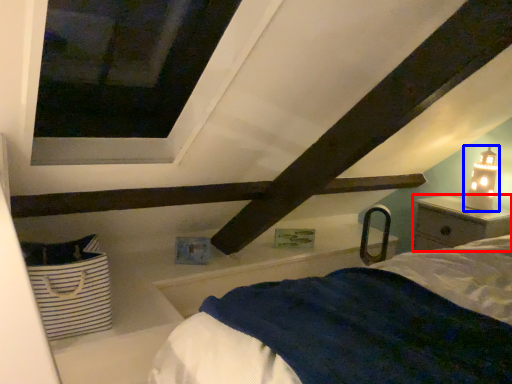
Question: Which object is closer to the camera taking this photo, nightstand (highlighted by a red box) or table lamp (highlighted by a blue box)?

Choices:
 (A) nightstand
 (B) table lamp

Answer: (A)